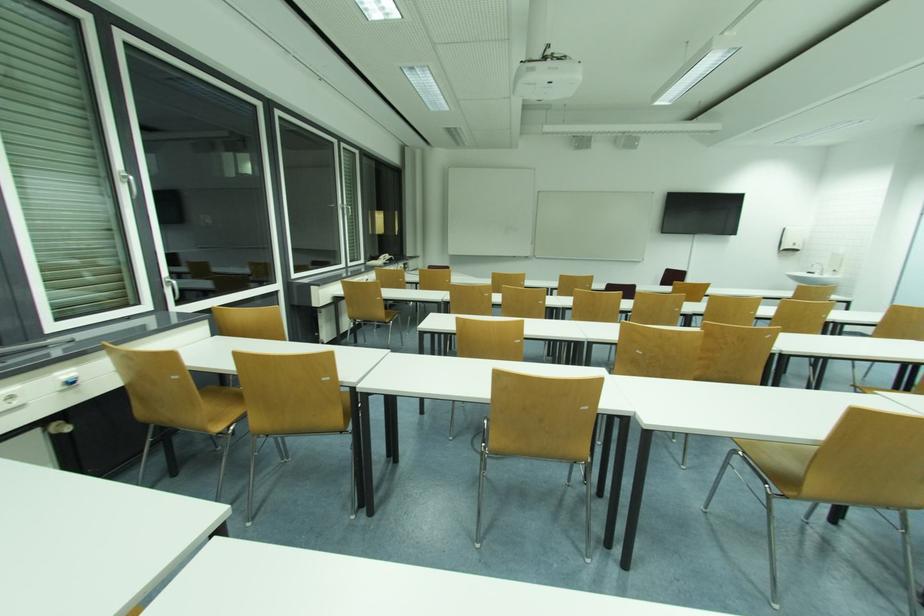
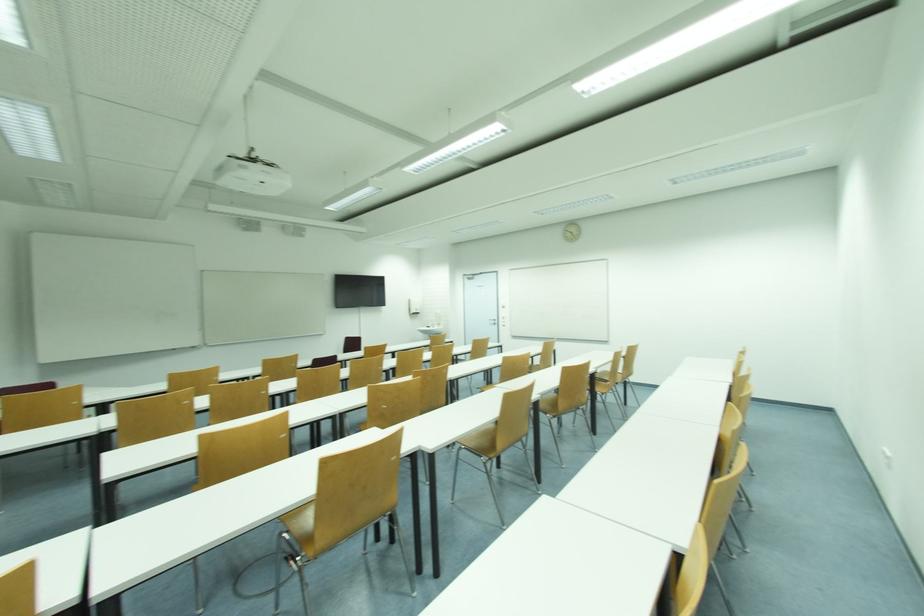
Question: The camera is either moving clockwise (left) or counter-clockwise (right) around the object. The first image is from the beginning of the video and the second image is from the end. Is the camera moving left or right when shooting the video?

Choices:
 (A) Left
 (B) Right

Answer: (A)